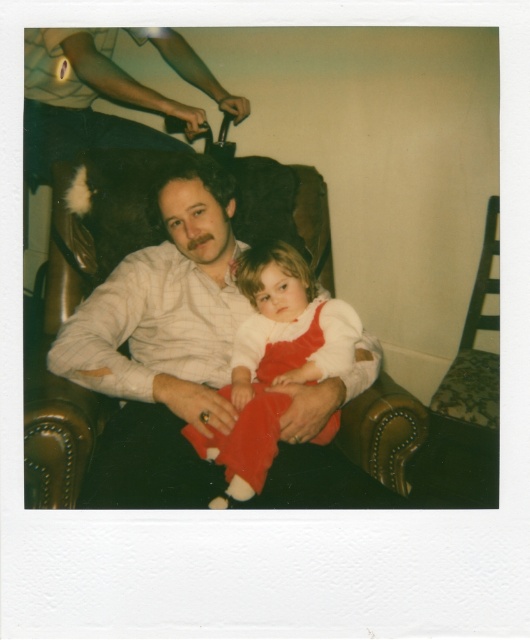
Question: Which is farther from the matte white shirt at center?

Choices:
 (A) velvet red dress at center
 (B) matte brown leather chair at upper left

Answer: (B)

Question: Is matte white shirt at center to the right of velvet red dress at center from the viewer's perspective?

Choices:
 (A) yes
 (B) no

Answer: (B)

Question: Among these objects, which one is farthest from the camera?

Choices:
 (A) velvet red dress at center
 (B) matte white shirt at center

Answer: (A)

Question: In this image, where is velvet red dress at center located relative to matte brown leather chair at upper left?

Choices:
 (A) below
 (B) above

Answer: (A)

Question: Among these objects, which one is nearest to the camera?

Choices:
 (A) matte brown leather chair at upper left
 (B) velvet red dress at center

Answer: (B)

Question: Is velvet red dress at center smaller than matte brown leather chair at upper left?

Choices:
 (A) no
 (B) yes

Answer: (B)